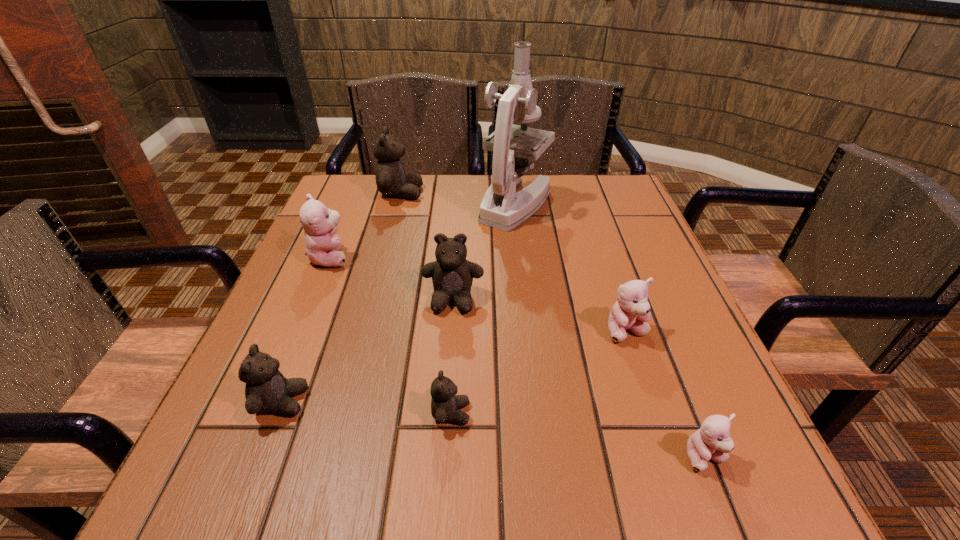
Find the location of a particular element. The height and width of the screenshot is (540, 960). gray microscope is located at coordinates [501, 207].

Image resolution: width=960 pixels, height=540 pixels. In order to click on microscope in this screenshot , I will do `click(501, 207)`.

Locate an element on the screen. Image resolution: width=960 pixels, height=540 pixels. the biggest brown teddy bear is located at coordinates (391, 180).

Where is `the farthest brown teddy bear`? the farthest brown teddy bear is located at coordinates (391, 180).

Locate an element on the screen. Image resolution: width=960 pixels, height=540 pixels. the farthest pink teddy bear is located at coordinates (319, 223).

Find the location of a particular element. This screenshot has height=540, width=960. the sixth nearest teddy bear is located at coordinates pyautogui.click(x=319, y=223).

Locate an element on the screen. the fifth nearest object is located at coordinates (452, 275).

The height and width of the screenshot is (540, 960). What are the coordinates of `the second biggest brown teddy bear` in the screenshot? It's located at (452, 275).

At what (x,y) coordinates should I click in order to perform the action: click on the third biggest brown teddy bear. Please return your answer as a coordinate pair (x, y). Looking at the image, I should click on (267, 390).

What are the coordinates of `the second farthest pink teddy bear` in the screenshot? It's located at (631, 312).